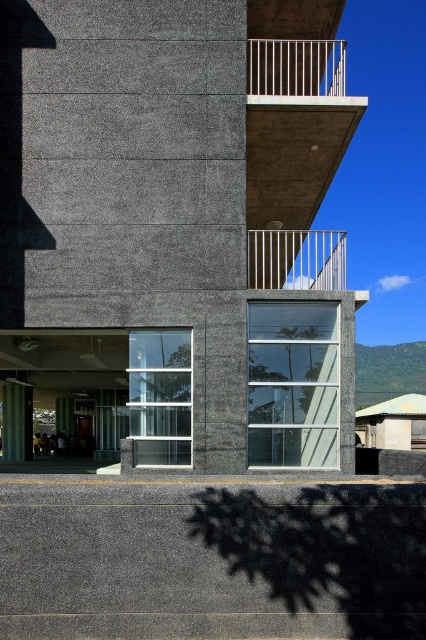
Consider the image. Is gray concrete at lower center positioned in front of silver metallic railing at upper center?

Yes.

The width and height of the screenshot is (426, 640). Describe the element at coordinates (212, 561) in the screenshot. I see `gray concrete at lower center` at that location.

I want to click on gray concrete at lower center, so click(212, 561).

Does silver metallic railing at upper center appear on the right side of white metal railing at upper center?

No, silver metallic railing at upper center is not to the right of white metal railing at upper center.

What do you see at coordinates (296, 259) in the screenshot? I see `silver metallic railing at upper center` at bounding box center [296, 259].

Identify the location of silver metallic railing at upper center. (296, 259).

Is point (77, 483) positioned in front of point (261, 81)?

Yes, it is in front of point (261, 81).

Between point (184, 548) and point (328, 61), which one is positioned behind?

Point (328, 61)

Where is `gray concrete at lower center`? Image resolution: width=426 pixels, height=640 pixels. gray concrete at lower center is located at coordinates (212, 561).